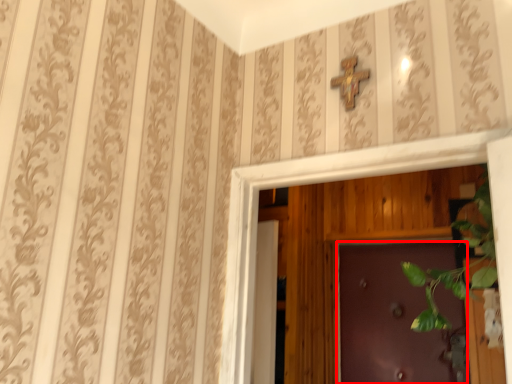
Question: From the image's perspective, considering the relative positions of door (annotated by the red box) and cross in the image provided, where is door (annotated by the red box) located with respect to the staircase?

Choices:
 (A) above
 (B) below

Answer: (B)